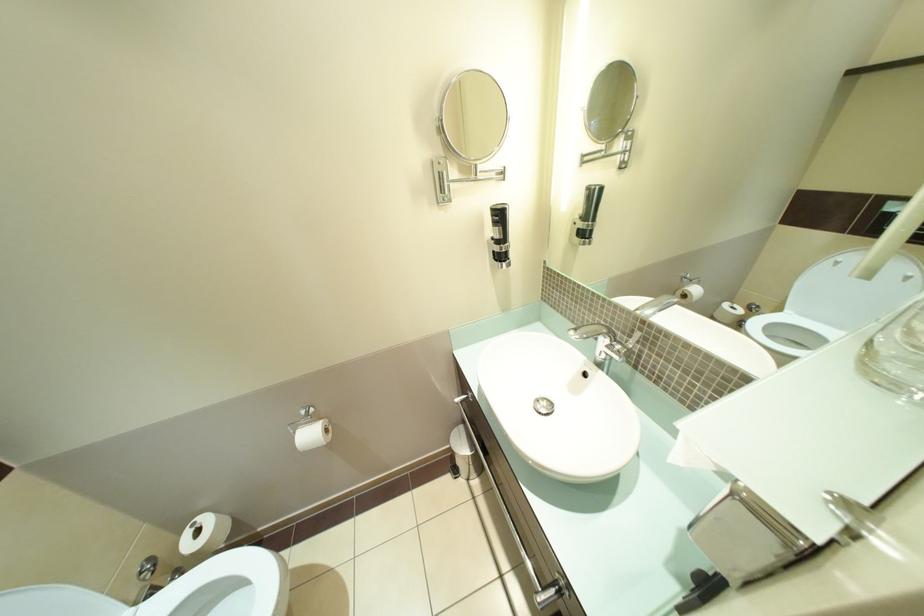
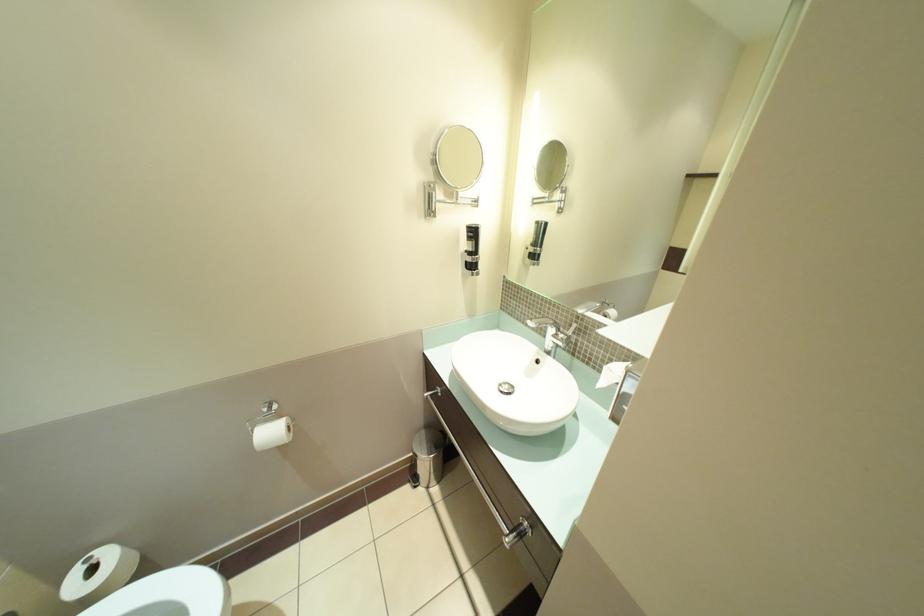
Question: The images are taken continuously from a first-person perspective. In which direction is your viewpoint rotating?

Choices:
 (A) Left
 (B) Right
 (C) Up
 (D) Down

Answer: (B)